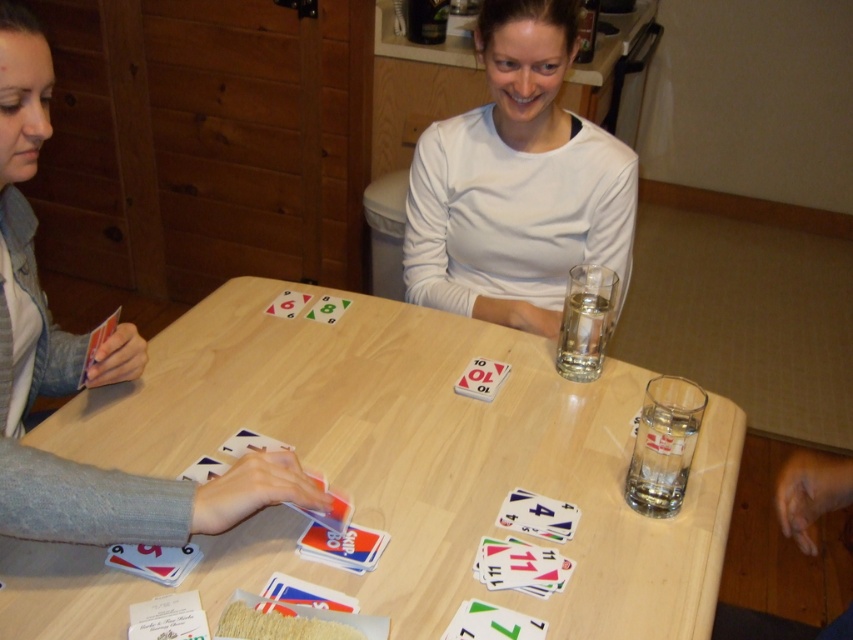
Measure the distance between white matte card at center and matte plastic card at center.

They are 16.40 inches apart.

Is white matte card at center shorter than matte plastic card at center?

Incorrect, white matte card at center's height does not fall short of matte plastic card at center's.

The width and height of the screenshot is (853, 640). I want to click on white matte card at center, so click(x=480, y=378).

Can you confirm if white matte shirt at upper center is positioned to the left of green matte card at center?

No, white matte shirt at upper center is not to the left of green matte card at center.

Between point (480, 45) and point (341, 305), which one is positioned behind?

Point (341, 305)

Describe the element at coordinates (517, 182) in the screenshot. I see `white matte shirt at upper center` at that location.

At what (x,y) coordinates should I click in order to perform the action: click on white matte shirt at upper center. Please return your answer as a coordinate pair (x, y). The image size is (853, 640). Looking at the image, I should click on (517, 182).

How distant is wooden table at center from white matte shirt at upper center?

wooden table at center is 14.36 inches away from white matte shirt at upper center.

Is point (476, 403) farther from viewer compared to point (605, 189)?

No.

Locate an element on the screen. Image resolution: width=853 pixels, height=640 pixels. wooden table at center is located at coordinates (418, 460).